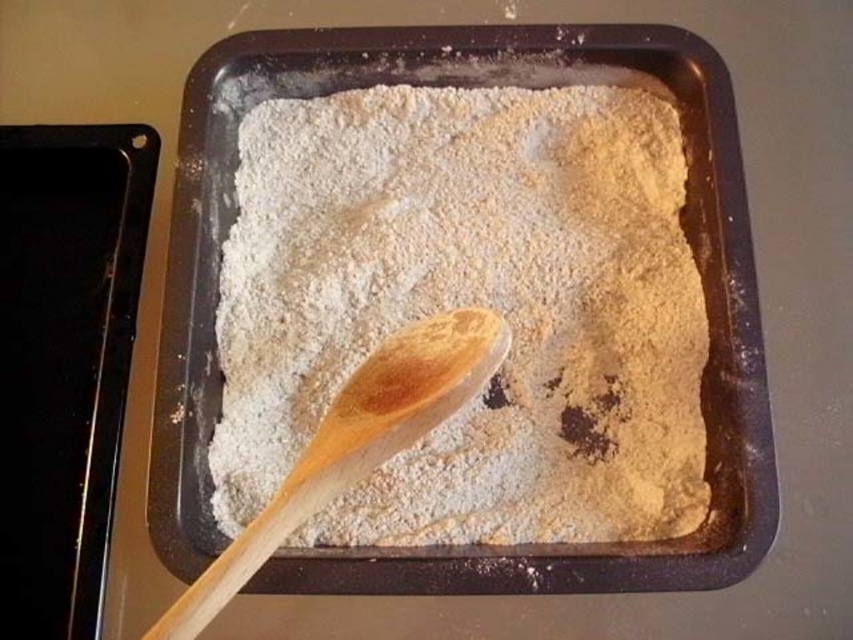
Does light brown powder at center have a larger size compared to wooden spoon at center?

Correct, light brown powder at center is larger in size than wooden spoon at center.

From the picture: Which is more to the right, light brown powder at center or wooden spoon at center?

light brown powder at center

Does point (332, 227) come farther from viewer compared to point (498, 333)?

Yes, point (332, 227) is farther from viewer.

Where is `light brown powder at center`? The width and height of the screenshot is (853, 640). light brown powder at center is located at coordinates (469, 305).